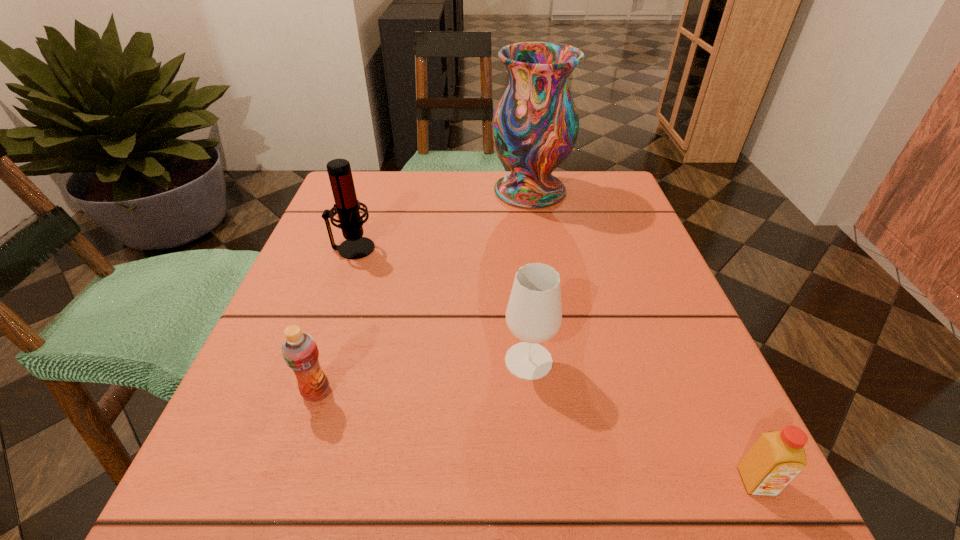
At what (x,y) coordinates should I click in order to perform the action: click on vacant space that is in between the fourth tallest object and the microphone. Please return your answer as a coordinate pair (x, y). The image size is (960, 540). Looking at the image, I should click on (335, 320).

Find the location of a particular element. empty location between the vase and the farther orange juice is located at coordinates (423, 292).

Where is `free point between the fourth nearest object and the taller orange juice`? The image size is (960, 540). free point between the fourth nearest object and the taller orange juice is located at coordinates (335, 320).

Where is `free spot between the nearest object and the left orange juice`? The height and width of the screenshot is (540, 960). free spot between the nearest object and the left orange juice is located at coordinates (537, 437).

Where is `free space between the fourth nearest object and the tallest object`? free space between the fourth nearest object and the tallest object is located at coordinates (442, 219).

Identify the location of unoccupied position between the nearest object and the glass. (642, 421).

This screenshot has height=540, width=960. I want to click on vacant space in between the taller orange juice and the microphone, so click(335, 320).

Point out which object is positioned as the fourth nearest to the farther orange juice. Please provide its 2D coordinates. Your answer should be formatted as a tuple, i.e. [(x, y)], where the tuple contains the x and y coordinates of a point satisfying the conditions above.

[(776, 458)]

Identify which object is the third closest to the fourth nearest object. Please provide its 2D coordinates. Your answer should be formatted as a tuple, i.e. [(x, y)], where the tuple contains the x and y coordinates of a point satisfying the conditions above.

[(534, 313)]

The image size is (960, 540). In order to click on free space that satisfies the following two spatial constraints: 1. on the front side of the microphone; 2. on the right side of the taller orange juice in this screenshot , I will do `click(301, 392)`.